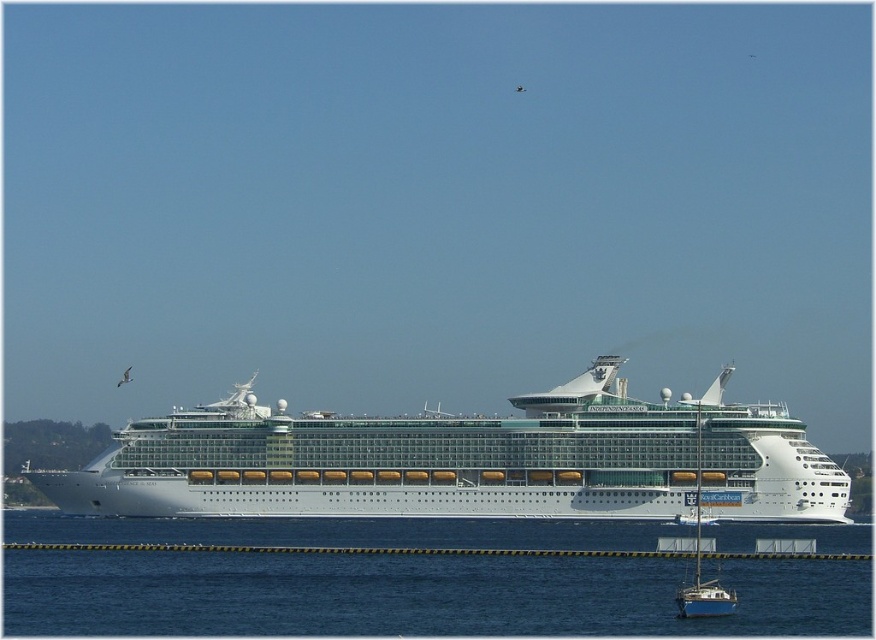
Between blue water at lower center and white glossy cruise ship at center, which one is positioned lower?

blue water at lower center is lower down.

Can you confirm if blue water at lower center is taller than white glossy cruise ship at center?

No, blue water at lower center is not taller than white glossy cruise ship at center.

Find the location of a particular element. This screenshot has width=876, height=640. blue water at lower center is located at coordinates (415, 595).